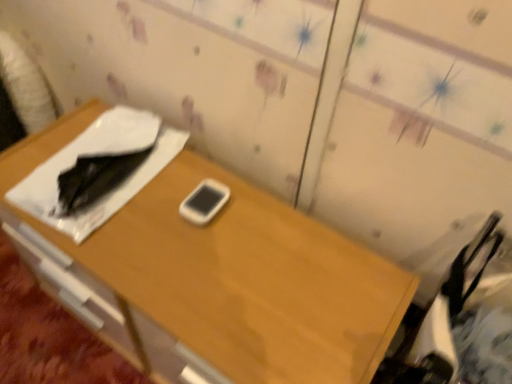
Locate an element on the screen. The image size is (512, 384). white matte mobile phone at center is located at coordinates (204, 202).

What is the approximate height of white matte mobile phone at center?

white matte mobile phone at center is 3.92 centimeters in height.

Describe the element at coordinates (204, 202) in the screenshot. I see `white matte mobile phone at center` at that location.

Describe the element at coordinates (234, 272) in the screenshot. I see `wooden desk at center` at that location.

Identify the location of wooden desk at center. This screenshot has width=512, height=384. tap(234, 272).

You are a GUI agent. You are given a task and a screenshot of the screen. Output one action in this format:
    pyautogui.click(x=<x>, y=<y>)
    Task: Click on the white matte mobile phone at center
    
    Given the screenshot: What is the action you would take?
    pyautogui.click(x=204, y=202)

Considering the relative positions of wooden desk at center and white matte mobile phone at center in the image provided, is wooden desk at center to the left of white matte mobile phone at center from the viewer's perspective?

Indeed, wooden desk at center is positioned on the left side of white matte mobile phone at center.

Is wooden desk at center in front of or behind white matte mobile phone at center in the image?

wooden desk at center is in front of white matte mobile phone at center.

Considering the points (246, 239) and (205, 219), which point is behind, point (246, 239) or point (205, 219)?

The point (205, 219) is more distant.

From the image's perspective, between wooden desk at center and white matte mobile phone at center, which one is located above?

white matte mobile phone at center, from the image's perspective.

From a real-world perspective, between wooden desk at center and white matte mobile phone at center, who is vertically lower?

wooden desk at center, from a real-world perspective.

Which object is thinner, wooden desk at center or white matte mobile phone at center?

white matte mobile phone at center.

Who is taller, wooden desk at center or white matte mobile phone at center?

With more height is wooden desk at center.

Between wooden desk at center and white matte mobile phone at center, which one has smaller size?

white matte mobile phone at center.

Is wooden desk at center located outside white matte mobile phone at center?

Absolutely, wooden desk at center is external to white matte mobile phone at center.

Is wooden desk at center beside white matte mobile phone at center?

wooden desk at center is not next to white matte mobile phone at center, and they're not touching.

Is wooden desk at center oriented towards white matte mobile phone at center?

No, wooden desk at center does not turn towards white matte mobile phone at center.

Locate an element on the screen. This screenshot has height=384, width=512. desk in front of the white matte mobile phone at center is located at coordinates (234, 272).

In the scene shown: Considering the relative positions of white matte mobile phone at center and wooden desk at center in the image provided, is white matte mobile phone at center to the left or to the right of wooden desk at center?

In the image, white matte mobile phone at center appears on the right side of wooden desk at center.

Does white matte mobile phone at center lie behind wooden desk at center?

Yes, white matte mobile phone at center is behind wooden desk at center.

Which is behind, point (206, 193) or point (162, 208)?

The point (206, 193) is behind.

From the image's perspective, is white matte mobile phone at center beneath wooden desk at center?

Actually, white matte mobile phone at center appears above wooden desk at center in the image.

From a real-world perspective, is white matte mobile phone at center on top of wooden desk at center?

Yes.

Which of these two, white matte mobile phone at center or wooden desk at center, is wider?

wooden desk at center is wider.

Is white matte mobile phone at center taller or shorter than wooden desk at center?

white matte mobile phone at center is shorter than wooden desk at center.

In terms of size, does white matte mobile phone at center appear bigger or smaller than wooden desk at center?

Clearly, white matte mobile phone at center is smaller in size than wooden desk at center.

Do you think white matte mobile phone at center is within wooden desk at center, or outside of it?

white matte mobile phone at center is located inside wooden desk at center.

Is white matte mobile phone at center with wooden desk at center?

No, white matte mobile phone at center is not beside wooden desk at center.

Could you tell me if white matte mobile phone at center is facing wooden desk at center?

No, white matte mobile phone at center is not oriented towards wooden desk at center.

How many degrees apart are the facing directions of white matte mobile phone at center and wooden desk at center?

The facing directions of white matte mobile phone at center and wooden desk at center are 2.39 degrees apart.

Where is `mobile phone above the wooden desk at center (from the image's perspective)`? The height and width of the screenshot is (384, 512). mobile phone above the wooden desk at center (from the image's perspective) is located at coordinates (204, 202).

Where is `mobile phone above the wooden desk at center (from a real-world perspective)`? This screenshot has width=512, height=384. mobile phone above the wooden desk at center (from a real-world perspective) is located at coordinates (204, 202).

Where is `mobile phone lying above the wooden desk at center (from the image's perspective)`? The width and height of the screenshot is (512, 384). mobile phone lying above the wooden desk at center (from the image's perspective) is located at coordinates (204, 202).